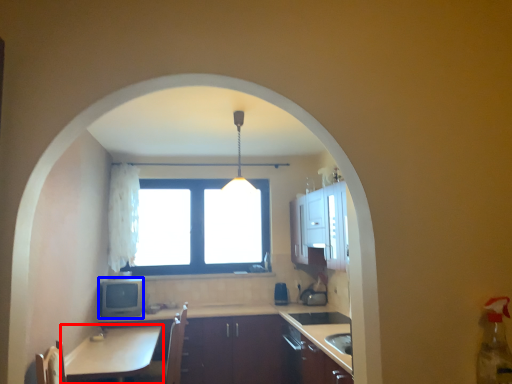
Question: Which of the following is the farthest to the observer, table (highlighted by a red box) or appliance (highlighted by a blue box)?

Choices:
 (A) table
 (B) appliance

Answer: (B)